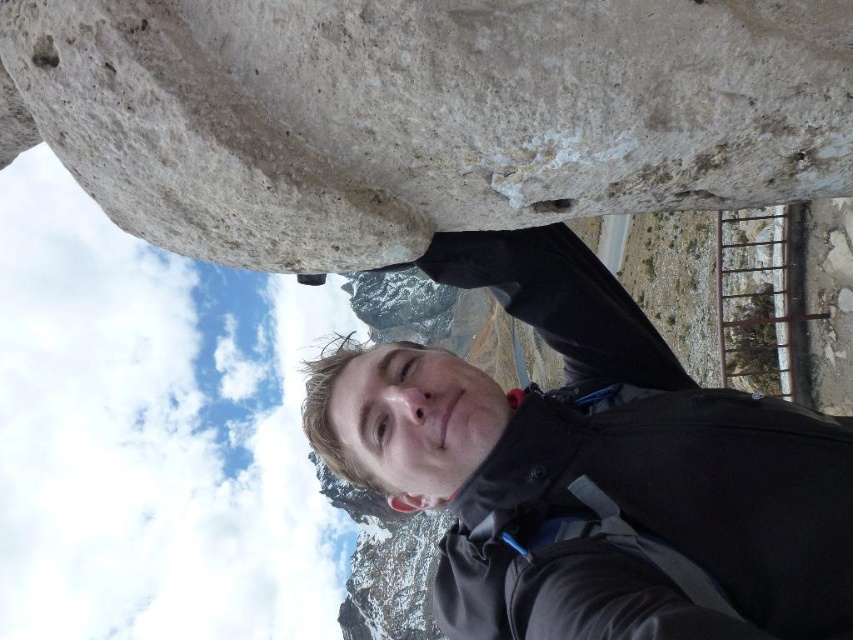
Question: Which object is farther from the camera taking this photo?

Choices:
 (A) black matte jacket at center
 (B) white rough stone at upper center

Answer: (A)

Question: Is white rough stone at upper center smaller than black matte jacket at center?

Choices:
 (A) yes
 (B) no

Answer: (A)

Question: Can you confirm if white rough stone at upper center is bigger than black matte jacket at center?

Choices:
 (A) yes
 (B) no

Answer: (B)

Question: Does white rough stone at upper center lie in front of black matte jacket at center?

Choices:
 (A) no
 (B) yes

Answer: (B)